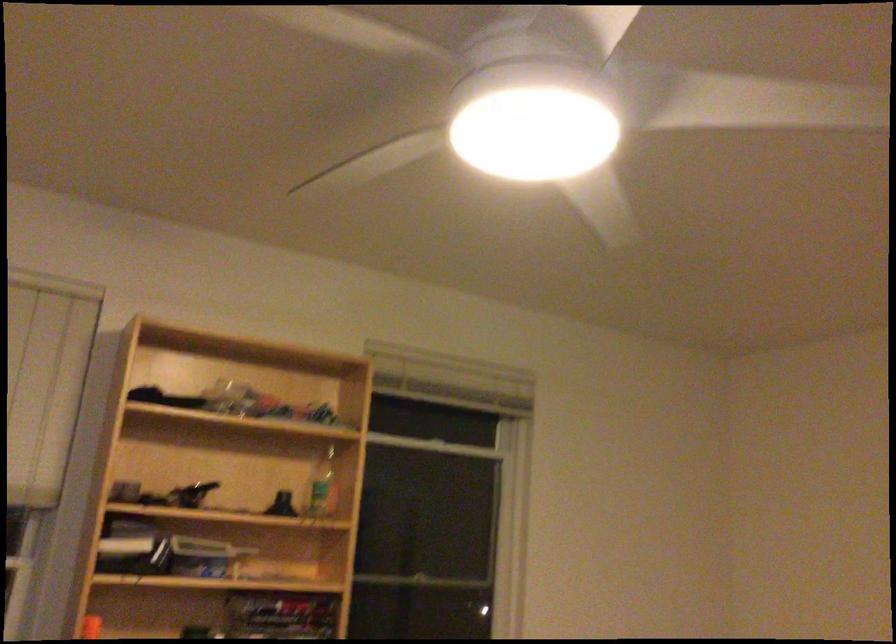
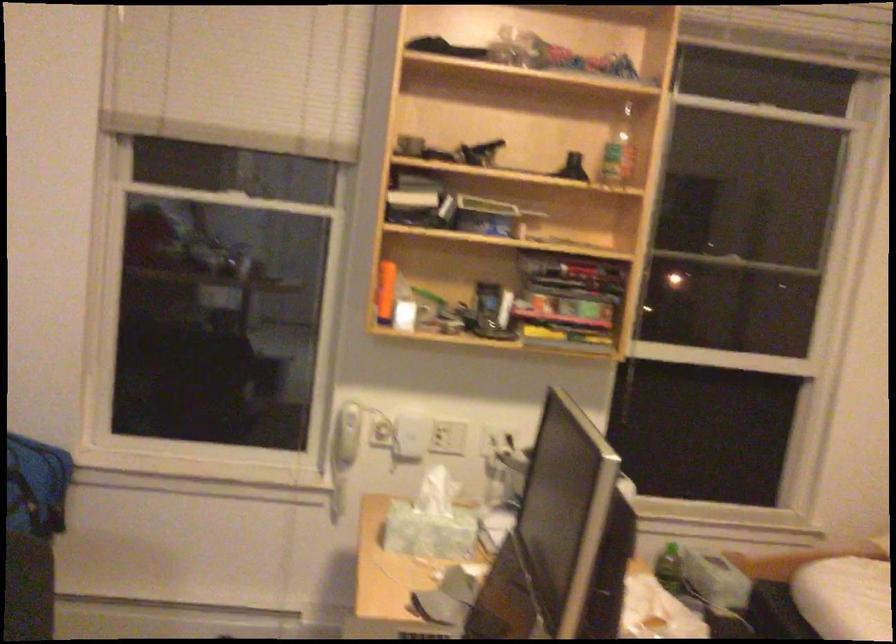
Locate, in the second image, the point that corresponds to point 323,486 in the first image.

(617, 151)